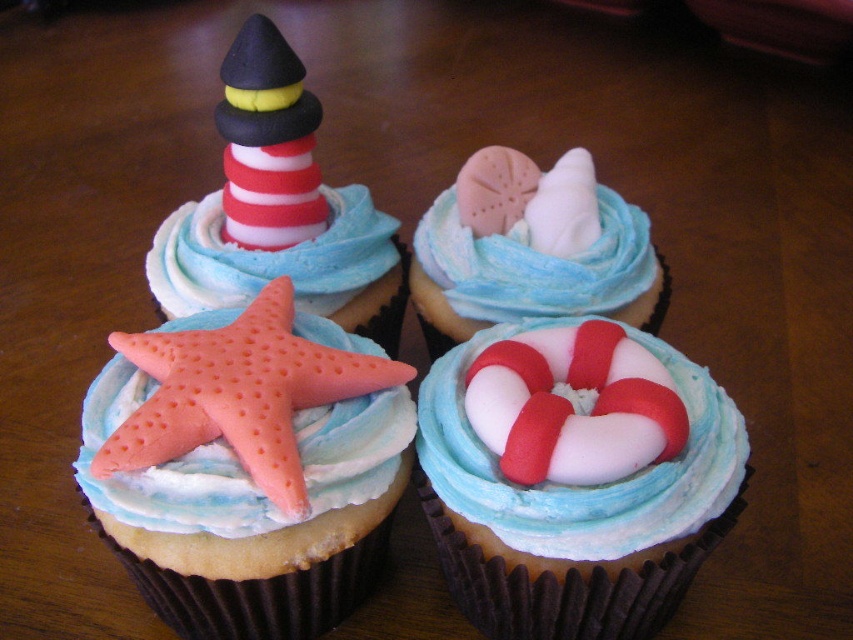
You are a baker arranging decorations on a cupcake. You have a smooth white life preserver at center and a matte pink starfish at upper left. According to the arrangement in the image, which decoration is placed to the right of the other?

The smooth white life preserver at center is positioned on the right side of the matte pink starfish at upper left.

You are a baker arranging decorations on a cupcake. You have a smooth white life preserver at center and a white fondant seashell at upper center. Where should you place the life preserver relative to the seashell to match the cupcake design?

The smooth white life preserver at center should be placed below the white fondant seashell at upper center to match the cupcake design.